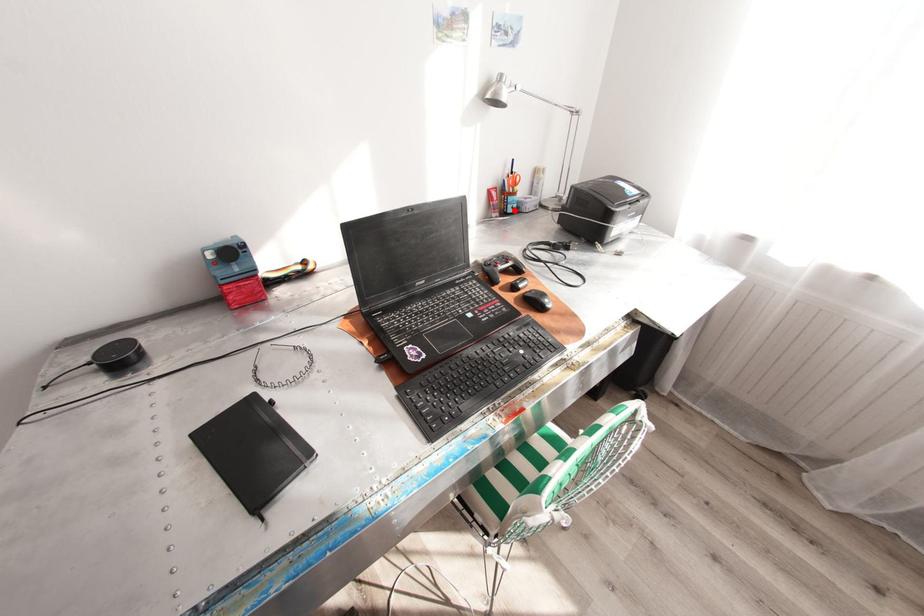
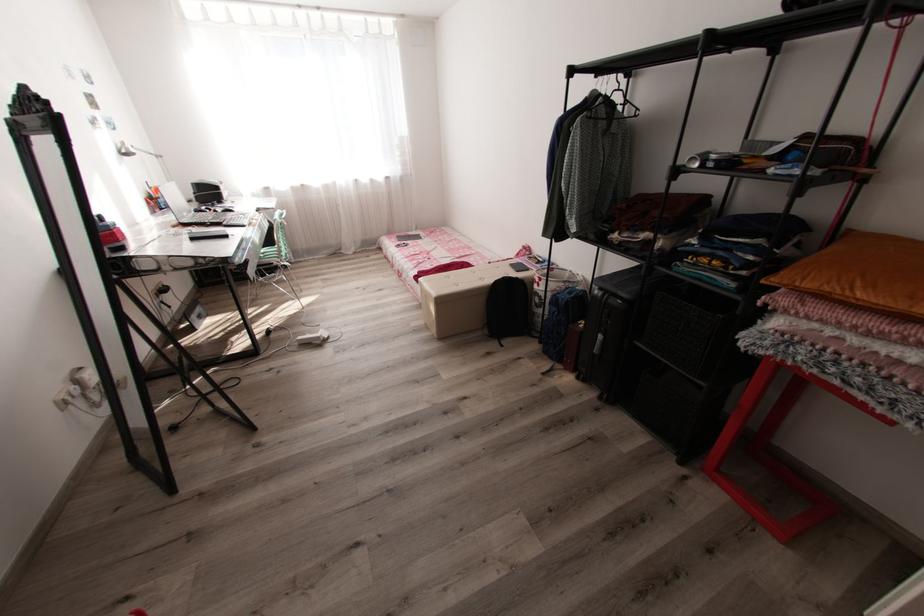
Where in the second image is the point corresponding to the highlighted location from the first image?

(167, 207)